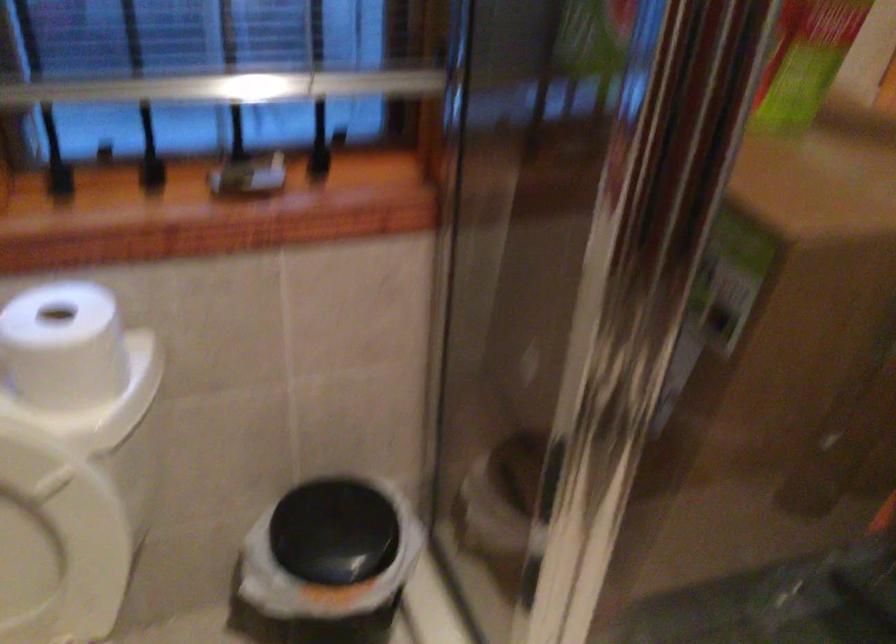
At what (x,y) coordinates should I click in order to perform the action: click on black trash can lid. Please return your answer as a coordinate pair (x, y). The height and width of the screenshot is (644, 896). Looking at the image, I should click on (333, 532).